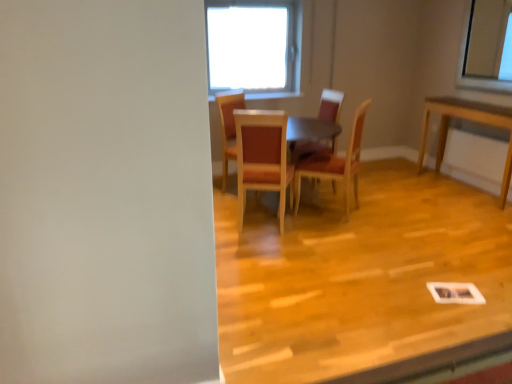
This screenshot has height=384, width=512. What do you see at coordinates (273, 154) in the screenshot?
I see `wooden table at center` at bounding box center [273, 154].

The width and height of the screenshot is (512, 384). Identify the location of wooden table at center. (273, 154).

What do you see at coordinates (330, 105) in the screenshot? The width and height of the screenshot is (512, 384). I see `wooden chair at center, which appears as the third chair when viewed from the left` at bounding box center [330, 105].

This screenshot has height=384, width=512. Identify the location of wooden chair at center, the first chair in the right-to-left sequence. (336, 163).

Locate an element on the screen. The width and height of the screenshot is (512, 384). wooden chair at center, positioned as the second chair in left-to-right order is located at coordinates (262, 157).

Based on the photo, in the image, is wooden chair at center, the first chair in the right-to-left sequence, on the left side or the right side of wooden chair at center, which ranks as the third chair in right-to-left order?

wooden chair at center, the first chair in the right-to-left sequence, is positioned on wooden chair at center, which ranks as the third chair in right-to-left order,'s right side.

From a real-world perspective, which is physically below, wooden chair at center, the first chair in the right-to-left sequence, or wooden chair at center, positioned as the second chair in left-to-right order?

In real-world perspective, wooden chair at center, positioned as the second chair in left-to-right order, is lower.

Who is smaller, wooden chair at center, the fourth chair when ordered from left to right, or wooden chair at center, which ranks as the third chair in right-to-left order?

A: wooden chair at center, which ranks as the third chair in right-to-left order, is smaller.

Looking at this image, is wooden chair at center, the first chair in the right-to-left sequence, directly adjacent to wooden chair at center, which ranks as the third chair in right-to-left order?

wooden chair at center, the first chair in the right-to-left sequence, and wooden chair at center, which ranks as the third chair in right-to-left order, are clearly separated.

From a real-world perspective, is wooden chair at center, which appears as the third chair when viewed from the left, above or below wooden chair at center, marked as the first chair in a left-to-right arrangement?

Clearly, from a real-world perspective, wooden chair at center, which appears as the third chair when viewed from the left, is above wooden chair at center, marked as the first chair in a left-to-right arrangement.

Which is correct: wooden chair at center, which appears as the third chair when viewed from the left, is inside wooden chair at center, marked as the first chair in a left-to-right arrangement, or outside of it?

wooden chair at center, which appears as the third chair when viewed from the left, is not inside wooden chair at center, marked as the first chair in a left-to-right arrangement, it's outside.

Can you confirm if wooden chair at center, which appears as the third chair when viewed from the left, is wider than wooden chair at center, acting as the fourth chair starting from the right?

No, wooden chair at center, which appears as the third chair when viewed from the left, is not wider than wooden chair at center, acting as the fourth chair starting from the right.

Which of these two, wooden chair at center, which appears as the third chair when viewed from the left, or wooden chair at center, acting as the fourth chair starting from the right, stands taller?

With more height is wooden chair at center, which appears as the third chair when viewed from the left.

Measure the distance from wooden chair at center, which appears as the third chair when viewed from the left, to wooden chair at center, the first chair in the right-to-left sequence.

wooden chair at center, which appears as the third chair when viewed from the left, is 5.57 feet from wooden chair at center, the first chair in the right-to-left sequence.

Is wooden chair at center, the 2th chair positioned from the right, positioned with its back to wooden chair at center, the fourth chair when ordered from left to right?

No, wooden chair at center, the fourth chair when ordered from left to right, is not at the back of wooden chair at center, the 2th chair positioned from the right.

The height and width of the screenshot is (384, 512). In order to click on chair that is the 2nd object located above the wooden chair at center, the first chair in the right-to-left sequence (from the image's perspective) in this screenshot , I will do 330,105.

Does point (336, 120) come farther from viewer compared to point (357, 183)?

Yes, it is.

From the image's perspective, is wooden chair at center, acting as the fourth chair starting from the right, above or below wooden chair at center, which appears as the third chair when viewed from the left?

From the image's perspective, wooden chair at center, acting as the fourth chair starting from the right, appears below wooden chair at center, which appears as the third chair when viewed from the left.

In terms of height, does wooden chair at center, marked as the first chair in a left-to-right arrangement, look taller or shorter compared to wooden chair at center, the 2th chair positioned from the right?

Clearly, wooden chair at center, marked as the first chair in a left-to-right arrangement, is shorter compared to wooden chair at center, the 2th chair positioned from the right.

Locate an element on the screen. chair above the wooden chair at center, marked as the first chair in a left-to-right arrangement (from the image's perspective) is located at coordinates (330, 105).

Would you say wooden chair at center, marked as the first chair in a left-to-right arrangement, is inside or outside wooden chair at center, which appears as the third chair when viewed from the left?

wooden chair at center, marked as the first chair in a left-to-right arrangement, is located beyond the bounds of wooden chair at center, which appears as the third chair when viewed from the left.

From the picture: Is wooden chair at center, acting as the fourth chair starting from the right, completely or partially inside wooden chair at center, the fourth chair when ordered from left to right?

No, wooden chair at center, acting as the fourth chair starting from the right, is located outside of wooden chair at center, the fourth chair when ordered from left to right.

Is point (319, 161) closer or farther from the camera than point (227, 96)?

Point (319, 161).

From a real-world perspective, is wooden chair at center, the fourth chair when ordered from left to right, positioned above or below wooden chair at center, acting as the fourth chair starting from the right?

In terms of real-world spatial position, wooden chair at center, the fourth chair when ordered from left to right, is above wooden chair at center, acting as the fourth chair starting from the right.

Is wooden chair at center, the first chair in the right-to-left sequence, facing towards wooden chair at center, marked as the first chair in a left-to-right arrangement?

Yes, wooden chair at center, the first chair in the right-to-left sequence, is oriented towards wooden chair at center, marked as the first chair in a left-to-right arrangement.

In the image, is wooden chair at center, acting as the fourth chair starting from the right, positioned in front of or behind wooden chair at center, the first chair in the right-to-left sequence?

wooden chair at center, acting as the fourth chair starting from the right, is positioned farther from the viewer than wooden chair at center, the first chair in the right-to-left sequence.

Is wooden chair at center, acting as the fourth chair starting from the right, inside or outside of wooden chair at center, the fourth chair when ordered from left to right?

wooden chair at center, acting as the fourth chair starting from the right, exists outside the volume of wooden chair at center, the fourth chair when ordered from left to right.

Is wooden chair at center, marked as the first chair in a left-to-right arrangement, bigger or smaller than wooden chair at center, the first chair in the right-to-left sequence?

Considering their sizes, wooden chair at center, marked as the first chair in a left-to-right arrangement, takes up less space than wooden chair at center, the first chair in the right-to-left sequence.

Is wooden chair at center, marked as the first chair in a left-to-right arrangement, turned away from wooden chair at center, the first chair in the right-to-left sequence?

wooden chair at center, marked as the first chair in a left-to-right arrangement, is not turned away from wooden chair at center, the first chair in the right-to-left sequence.

Which of these two, wooden chair at center, the 2th chair positioned from the right, or wooden floor at center, stands taller?

Standing taller between the two is wooden chair at center, the 2th chair positioned from the right.

Where is `plywood below the wooden chair at center, the 2th chair positioned from the right (from a real-world perspective)`? This screenshot has height=384, width=512. plywood below the wooden chair at center, the 2th chair positioned from the right (from a real-world perspective) is located at coordinates (361, 280).

Is wooden chair at center, which appears as the third chair when viewed from the left, wider or thinner than wooden floor at center?

Clearly, wooden chair at center, which appears as the third chair when viewed from the left, has less width compared to wooden floor at center.

Does wooden chair at center, the 2th chair positioned from the right, lie behind wooden floor at center?

That is True.

The height and width of the screenshot is (384, 512). In order to click on chair in front of the wooden chair at center, the fourth chair when ordered from left to right in this screenshot , I will do `click(262, 157)`.

From a real-world perspective, starting from the wooden chair at center, acting as the fourth chair starting from the right, which chair is the 2nd one vertically above it? Please provide its 2D coordinates.

[(330, 105)]

Looking at the image, which one is located further to wooden chair at center, acting as the fourth chair starting from the right, wooden chair at center, the 2th chair positioned from the right, or wooden table at center?

wooden chair at center, the 2th chair positioned from the right, lies further to wooden chair at center, acting as the fourth chair starting from the right, than the other object.

Looking at the image, which one is located closer to wooden chair at center, the fourth chair when ordered from left to right, wooden floor at center or wooden chair at center, marked as the first chair in a left-to-right arrangement?

The object closer to wooden chair at center, the fourth chair when ordered from left to right, is wooden floor at center.

From the image, which object appears to be farther from wooden chair at center, positioned as the second chair in left-to-right order, wooden chair at center, acting as the fourth chair starting from the right, or wooden chair at center, the fourth chair when ordered from left to right?

Based on the image, wooden chair at center, the fourth chair when ordered from left to right, appears to be further to wooden chair at center, positioned as the second chair in left-to-right order.

Estimate the real-world distances between objects in this image. Which object is closer to wooden chair at center, which ranks as the third chair in right-to-left order, wooden table at center or wooden chair at center, marked as the first chair in a left-to-right arrangement?

wooden table at center is positioned closer to the anchor wooden chair at center, which ranks as the third chair in right-to-left order.

Estimate the real-world distances between objects in this image. Which object is further from wooden table at center, wooden floor at center or wooden chair at center, which ranks as the third chair in right-to-left order?

wooden floor at center is further to wooden table at center.

Which object lies further to the anchor point wooden chair at center, which ranks as the third chair in right-to-left order, wooden chair at center, acting as the fourth chair starting from the right, or wooden floor at center?

wooden floor at center is positioned further to the anchor wooden chair at center, which ranks as the third chair in right-to-left order.

Estimate the real-world distances between objects in this image. Which object is further from wooden table at center, wooden chair at center, marked as the first chair in a left-to-right arrangement, or wooden chair at center, the 2th chair positioned from the right?

Among the two, wooden chair at center, the 2th chair positioned from the right, is located further to wooden table at center.

When comparing their distances from wooden chair at center, marked as the first chair in a left-to-right arrangement, does wooden chair at center, the first chair in the right-to-left sequence, or wooden table at center seem further?

wooden chair at center, the first chair in the right-to-left sequence, lies further to wooden chair at center, marked as the first chair in a left-to-right arrangement, than the other object.

I want to click on table between wooden chair at center, marked as the first chair in a left-to-right arrangement, and wooden chair at center, the fourth chair when ordered from left to right, from left to right, so click(x=273, y=154).

Where is `table between wooden chair at center, acting as the fourth chair starting from the right, and wooden chair at center, the 2th chair positioned from the right, from left to right`? This screenshot has height=384, width=512. table between wooden chair at center, acting as the fourth chair starting from the right, and wooden chair at center, the 2th chair positioned from the right, from left to right is located at coordinates (273, 154).

You are a GUI agent. You are given a task and a screenshot of the screen. Output one action in this format:
    pyautogui.click(x=<x>, y=<y>)
    Task: Click on the table between wooden floor at center and wooden chair at center, marked as the first chair in a left-to-right arrangement, along the z-axis
    The image size is (512, 384).
    Given the screenshot: What is the action you would take?
    pyautogui.click(x=273, y=154)

Locate an element on the screen. The width and height of the screenshot is (512, 384). chair between wooden floor at center and wooden chair at center, the fourth chair when ordered from left to right, from front to back is located at coordinates (262, 157).